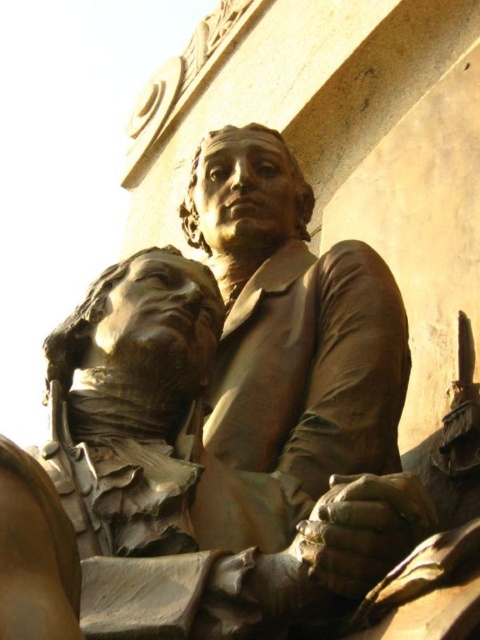
You are an art student standing in front of the bronze statue at center and the bronze bust at center. Which one do you need to step forward to touch?

You need to step forward to touch the bronze bust at center because it is further away from you than the bronze statue at center, which is closer.

You are standing in front of the bronze statue of two individuals. You notice two points marked on the statue at coordinates point (261, 397) and point (109, 273). Which point is closer to your eyes?

Point (261, 397) is further to the camera than point (109, 273), so the point closer to your eyes is point (109, 273).